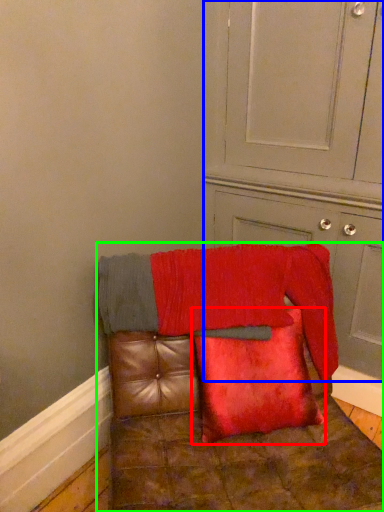
Question: Which object is the closest to the pillow (highlighted by a red box)? Choose among these: dresser (highlighted by a blue box) or furniture (highlighted by a green box).

Choices:
 (A) dresser
 (B) furniture

Answer: (B)